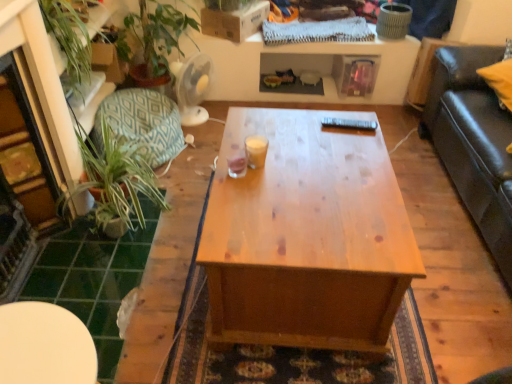
The width and height of the screenshot is (512, 384). Find the location of `free space above white glossy table at lower left (from a real-world perspective)`. free space above white glossy table at lower left (from a real-world perspective) is located at coordinates (39, 342).